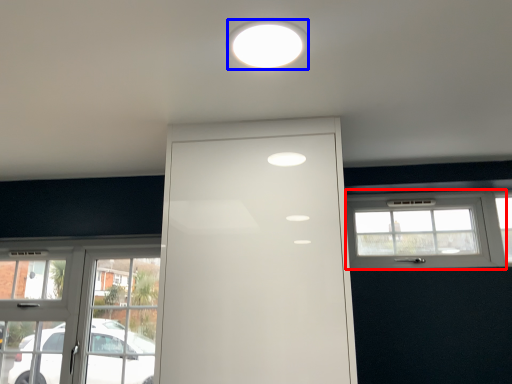
Question: Which of the following is the farthest to the observer, window (highlighted by a red box) or lighting (highlighted by a blue box)?

Choices:
 (A) window
 (B) lighting

Answer: (A)